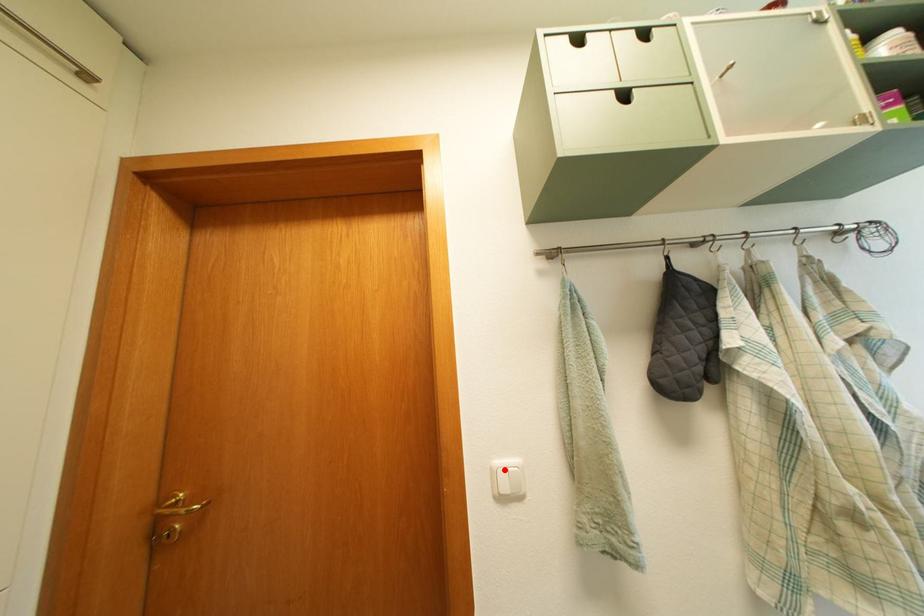
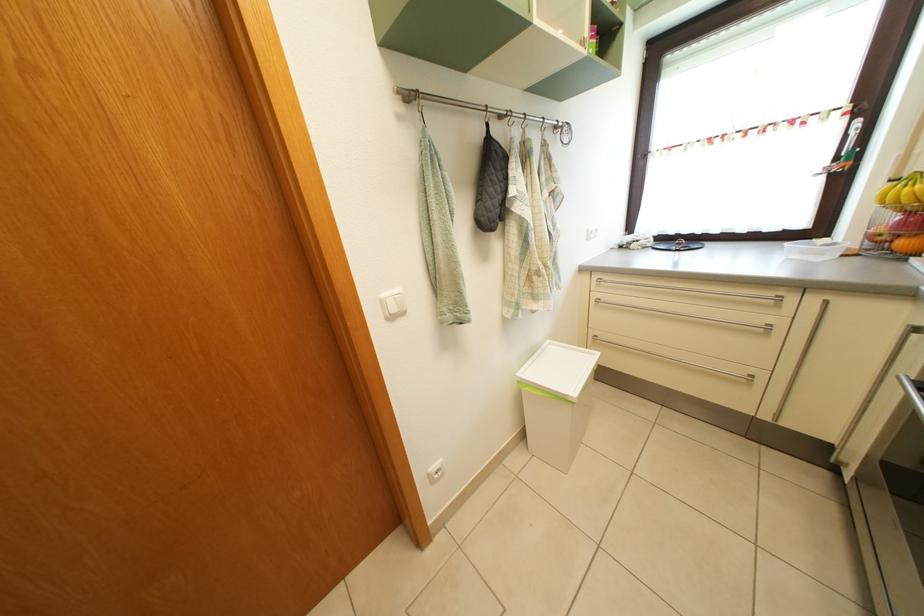
In the second image, find the point that corresponds to the highlighted location in the first image.

(392, 302)